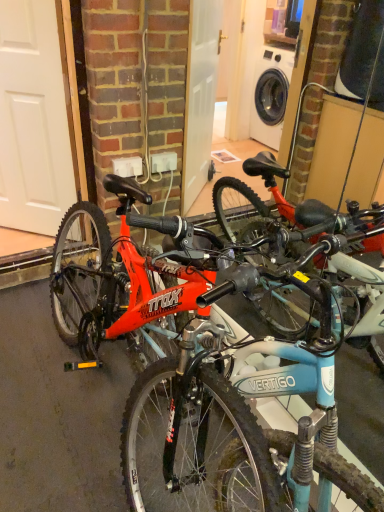
Question: In the image, is white matte door at left positioned in front of or behind shiny red bicycle at left?

Choices:
 (A) behind
 (B) front

Answer: (A)

Question: Do you think white matte door at left is within shiny red bicycle at left, or outside of it?

Choices:
 (A) inside
 (B) outside

Answer: (B)

Question: In terms of height, does white matte door at left look taller or shorter compared to shiny red bicycle at left?

Choices:
 (A) short
 (B) tall

Answer: (B)

Question: Relative to white matte door at left, is shiny red bicycle at left in front or behind?

Choices:
 (A) front
 (B) behind

Answer: (A)

Question: In terms of height, does shiny red bicycle at left look taller or shorter compared to white matte door at left?

Choices:
 (A) tall
 (B) short

Answer: (B)

Question: Looking at the image, does shiny red bicycle at left seem bigger or smaller compared to white matte door at left?

Choices:
 (A) big
 (B) small

Answer: (A)

Question: Is point (243, 339) closer or farther from the camera than point (29, 181)?

Choices:
 (A) closer
 (B) farther

Answer: (A)